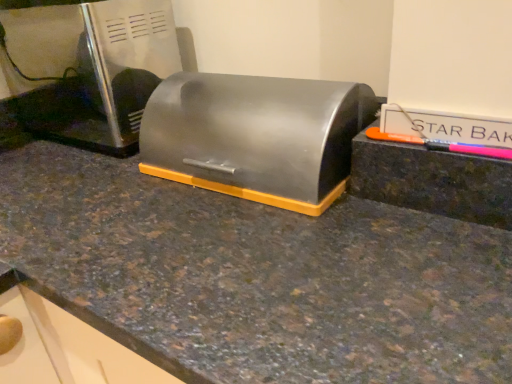
Question: Is point (225, 124) positioned closer to the camera than point (6, 54)?

Choices:
 (A) farther
 (B) closer

Answer: (B)

Question: Is satin silver breadbox at center taller or shorter than satin silver toaster at upper left?

Choices:
 (A) short
 (B) tall

Answer: (A)

Question: From the image's perspective, is satin silver breadbox at center above or below satin silver toaster at upper left?

Choices:
 (A) above
 (B) below

Answer: (B)

Question: In the image, is satin silver toaster at upper left positioned in front of or behind satin silver breadbox at center?

Choices:
 (A) front
 (B) behind

Answer: (B)

Question: From the image's perspective, is satin silver toaster at upper left positioned above or below satin silver breadbox at center?

Choices:
 (A) below
 (B) above

Answer: (B)

Question: Does point (92, 23) appear closer or farther from the camera than point (194, 145)?

Choices:
 (A) closer
 (B) farther

Answer: (B)

Question: Considering the positions of satin silver toaster at upper left and satin silver breadbox at center in the image, is satin silver toaster at upper left taller or shorter than satin silver breadbox at center?

Choices:
 (A) short
 (B) tall

Answer: (B)